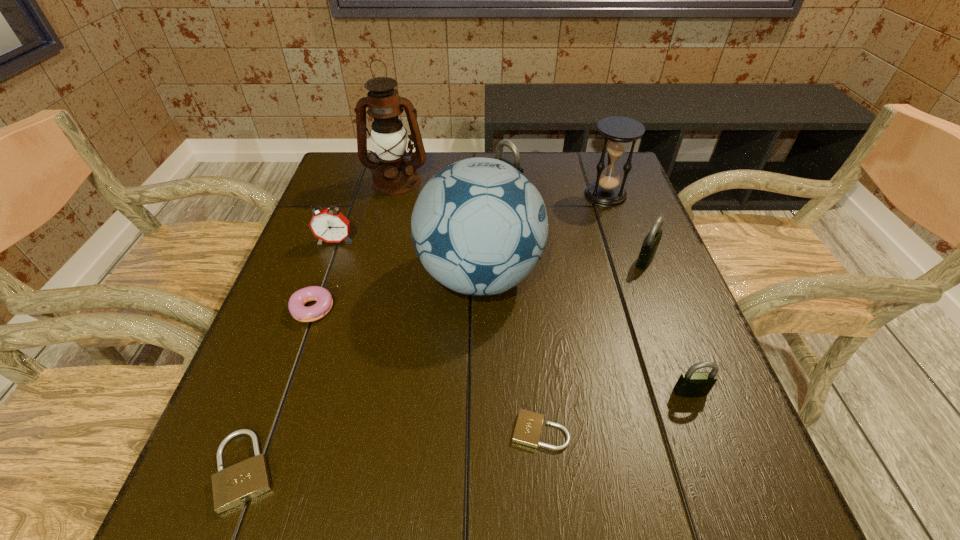
Identify the location of brown lantern. This screenshot has width=960, height=540. (394, 175).

I want to click on the tallest object, so 394,175.

Locate an element on the screen. soccer ball is located at coordinates (479, 226).

Image resolution: width=960 pixels, height=540 pixels. Find the location of `the second tallest object`. the second tallest object is located at coordinates (479, 226).

Identify the location of the third tallest object. This screenshot has width=960, height=540. (618, 132).

This screenshot has width=960, height=540. I want to click on black hourglass, so click(x=618, y=132).

You are a GUI agent. You are given a task and a screenshot of the screen. Output one action in this format:
    pyautogui.click(x=<x>, y=<y>)
    Task: Click on the farthest black padlock
    
    Given the screenshot: What is the action you would take?
    pyautogui.click(x=502, y=143)

Where is `the farthest padlock`? The image size is (960, 540). the farthest padlock is located at coordinates (502, 143).

The height and width of the screenshot is (540, 960). I want to click on the second tallest padlock, so click(x=650, y=244).

What are the coordinates of `the second nearest black padlock` in the screenshot? It's located at (650, 244).